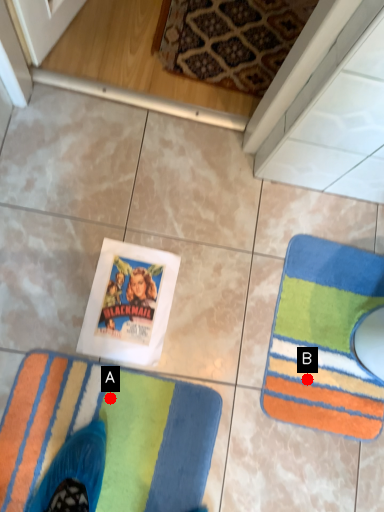
Question: Two points are circled on the image, labeled by A and B beside each circle. Which point is farther from the camera taking this photo?

Choices:
 (A) A is further
 (B) B is further

Answer: (B)